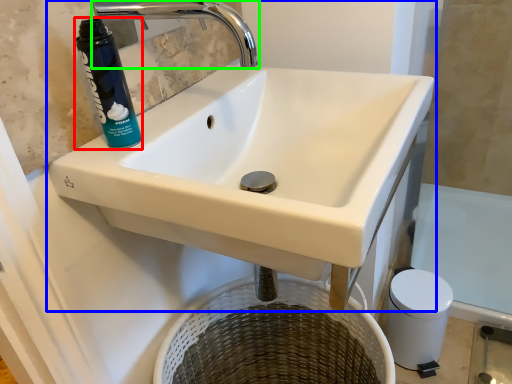
Question: Estimate the real-world distances between objects in this image. Which object is farther from cleaning product (highlighted by a red box), sink (highlighted by a blue box) or tap (highlighted by a green box)?

Choices:
 (A) sink
 (B) tap

Answer: (A)